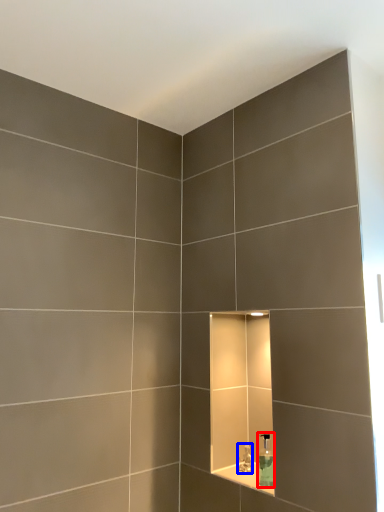
Question: Among these objects, which one is nearest to the camera, soap dispenser (highlighted by a red box) or faucet (highlighted by a blue box)?

Choices:
 (A) soap dispenser
 (B) faucet

Answer: (A)